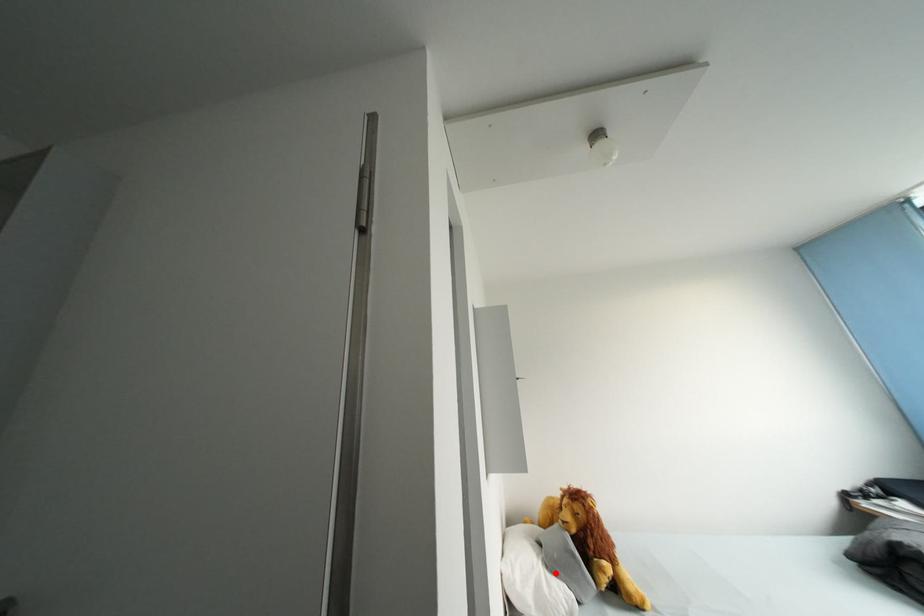
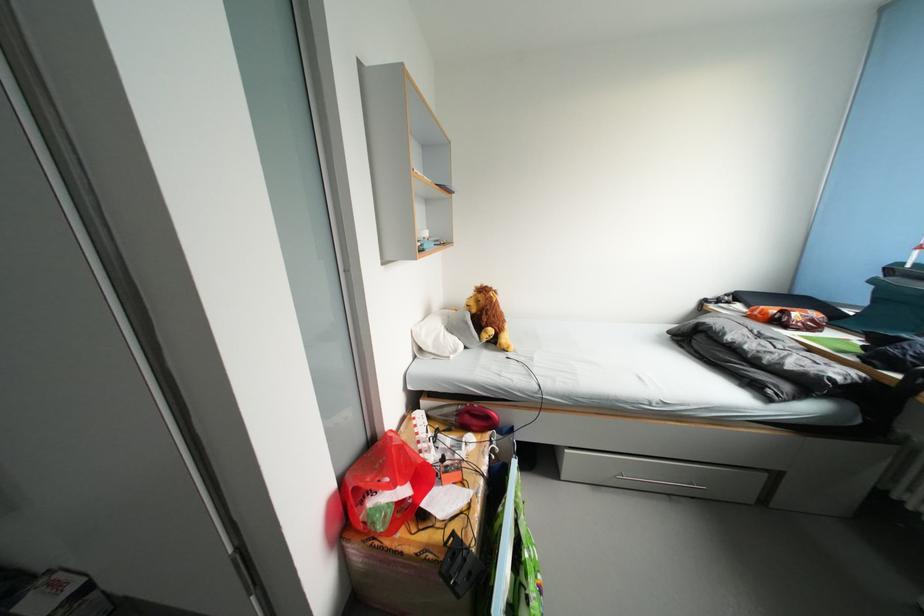
Locate, in the second image, the point that corresponds to the highlighted location in the first image.

(456, 334)